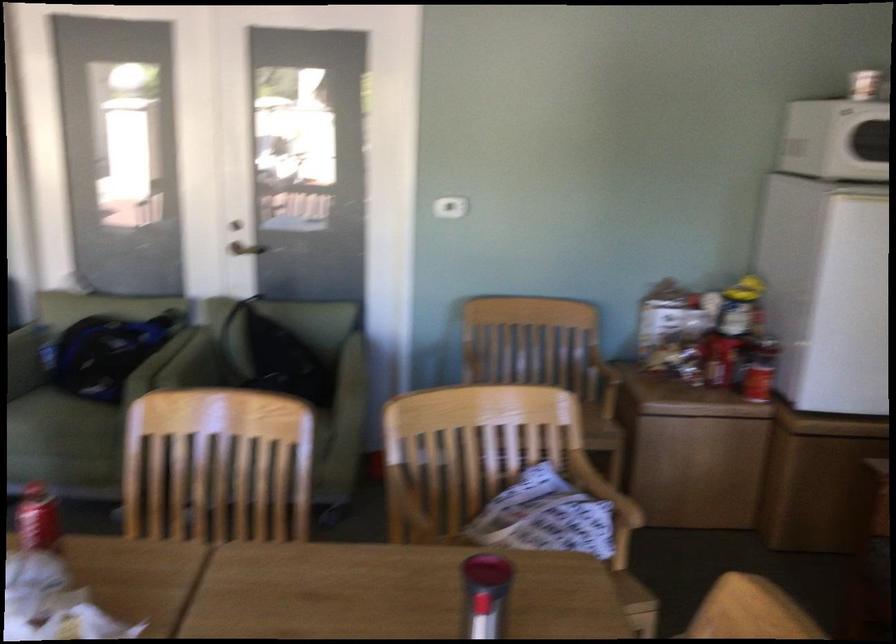
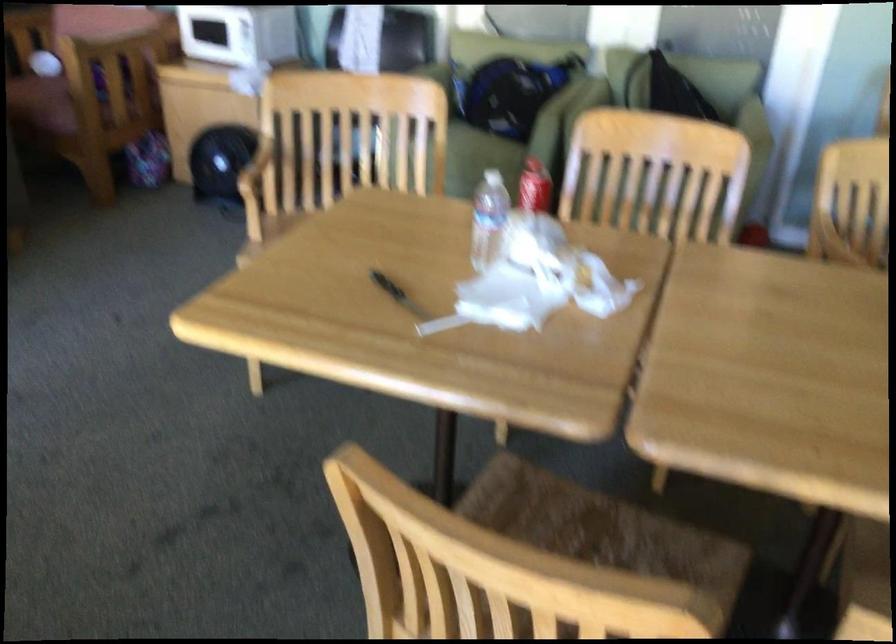
Question: I am providing you with two images of the same scene from different viewpoints. After the viewpoint changes to image2, which objects are now occluded?

Choices:
 (A) sofa sitting surface
 (B) black handle knife
 (C) red plastic caddy
 (D) chair armrest

Answer: (A)